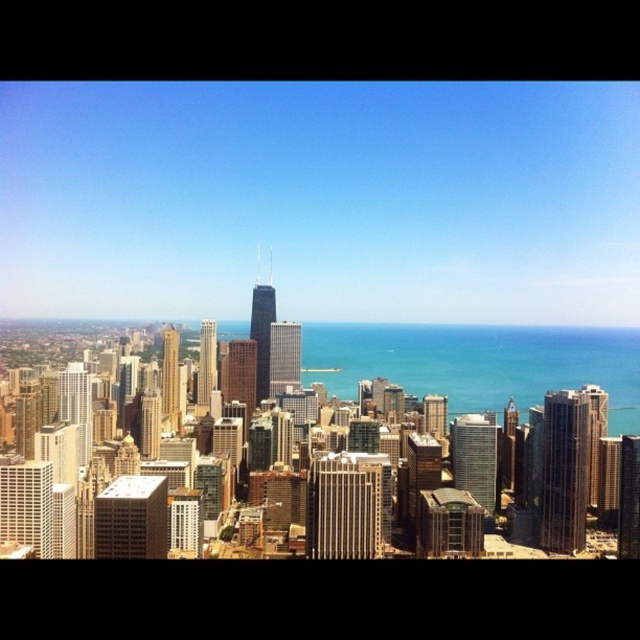
Is brown glass skyscraper at center-right above glass skyscraper at center?

No.

Looking at this image, who is positioned more to the left, brown glass skyscraper at center-right or glass skyscraper at center?

From the viewer's perspective, glass skyscraper at center appears more on the left side.

Between point (545, 397) and point (260, 378), which one is positioned in front?

Point (260, 378) is more forward.

Locate an element on the screen. The image size is (640, 640). brown glass skyscraper at center-right is located at coordinates (564, 470).

Is matte gray skyscraper at lower left wider than glassy reflective skyscraper at center?

Indeed, matte gray skyscraper at lower left has a greater width compared to glassy reflective skyscraper at center.

In order to click on matte gray skyscraper at lower left in this screenshot , I will do `click(131, 518)`.

Who is more distant from viewer, (557, 548) or (474, 426)?

Positioned behind is point (557, 548).

Is the position of brown glass skyscraper at center-right less distant than that of glassy reflective skyscraper at center?

No.

I want to click on brown glass skyscraper at center-right, so 564,470.